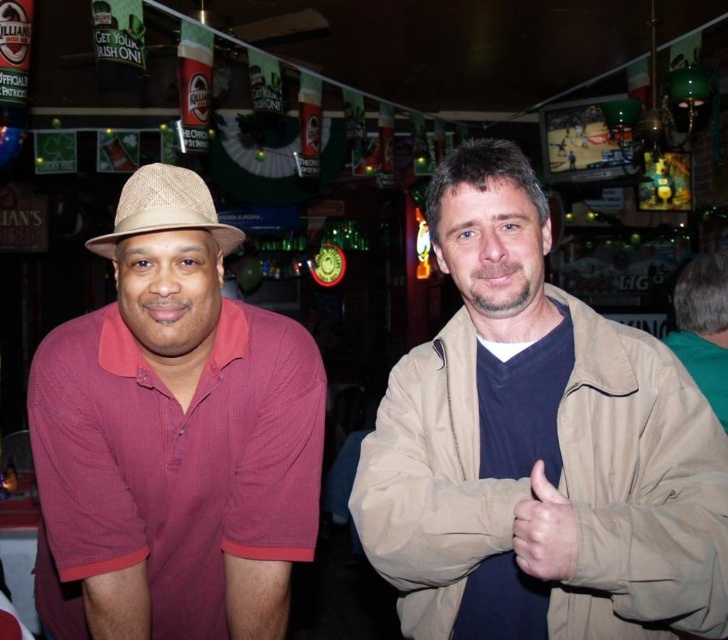
Two people are standing in a bar with festive decorations. The person on the left is wearing a matte red shirt at left. The person on the right is giving a thumbs up. How far apart are they?

They are 1.15 meters apart.

You are a photographer trying to capture the matte red shirt at left in the image. The camera you are using has a zoom lens with a minimum focal length of 50mm. The shirt is located at coordinates point 0.686, 0.239. If the camera sensor size is 24x36 mm and the field of view at 50mm is 46 degrees, will the shirt be fully visible in the frame?

The matte red shirt at left is located at point (x=173, y=438). Since the camera has a field of view of 46 degrees at 50mm, the shirt will be fully visible within the frame as long as it is within the sensor dimensions. However, without knowing the exact distance between the camera and the shirt, it is impossible to determine visibility with certainty.

You are a photographer at the bar and want to take a photo of the two people. You notice the matte red shirt at left and the tan woven fedora at left. Which item is positioned lower on the person?

The matte red shirt at left is located below tan woven fedora at left, so the matte red shirt at left is positioned lower on the person.